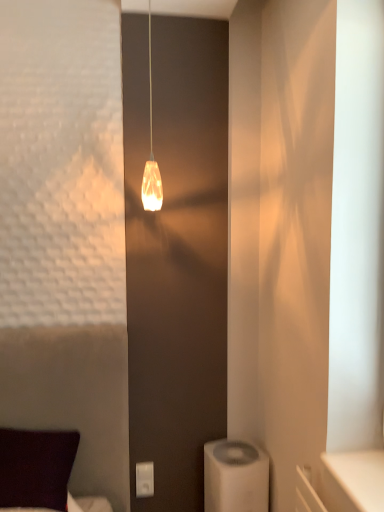
Question: Does white plastic air purifier at lower right appear on the left side of white plastic/light switch at lower center?

Choices:
 (A) yes
 (B) no

Answer: (B)

Question: Considering the relative sizes of white plastic air purifier at lower right and white plastic/light switch at lower center in the image provided, is white plastic air purifier at lower right wider than white plastic/light switch at lower center?

Choices:
 (A) yes
 (B) no

Answer: (A)

Question: Is white plastic/light switch at lower center a part of white plastic air purifier at lower right?

Choices:
 (A) no
 (B) yes

Answer: (A)

Question: Considering the relative sizes of white plastic air purifier at lower right and white plastic/light switch at lower center in the image provided, is white plastic air purifier at lower right bigger than white plastic/light switch at lower center?

Choices:
 (A) no
 (B) yes

Answer: (B)

Question: Is white plastic air purifier at lower right facing towards white plastic/light switch at lower center?

Choices:
 (A) no
 (B) yes

Answer: (A)

Question: Is translucent glass pendant light at center inside the boundaries of white plastic air purifier at lower right, or outside?

Choices:
 (A) inside
 (B) outside

Answer: (B)

Question: From a real-world perspective, is translucent glass pendant light at center above or below white plastic air purifier at lower right?

Choices:
 (A) below
 (B) above

Answer: (B)

Question: In terms of width, does translucent glass pendant light at center look wider or thinner when compared to white plastic air purifier at lower right?

Choices:
 (A) thin
 (B) wide

Answer: (A)

Question: In terms of height, does translucent glass pendant light at center look taller or shorter compared to white plastic air purifier at lower right?

Choices:
 (A) tall
 (B) short

Answer: (A)

Question: Is translucent glass pendant light at center inside or outside of dark purple fabric pillow at lower left?

Choices:
 (A) outside
 (B) inside

Answer: (A)

Question: Is translucent glass pendant light at center taller or shorter than dark purple fabric pillow at lower left?

Choices:
 (A) short
 (B) tall

Answer: (B)

Question: From a real-world perspective, relative to dark purple fabric pillow at lower left, is translucent glass pendant light at center vertically above or below?

Choices:
 (A) above
 (B) below

Answer: (A)

Question: Is translucent glass pendant light at center wider or thinner than dark purple fabric pillow at lower left?

Choices:
 (A) wide
 (B) thin

Answer: (B)

Question: From a real-world perspective, is dark purple fabric pillow at lower left positioned above or below white plastic air purifier at lower right?

Choices:
 (A) below
 (B) above

Answer: (B)

Question: Is dark purple fabric pillow at lower left in front of or behind white plastic air purifier at lower right in the image?

Choices:
 (A) front
 (B) behind

Answer: (A)